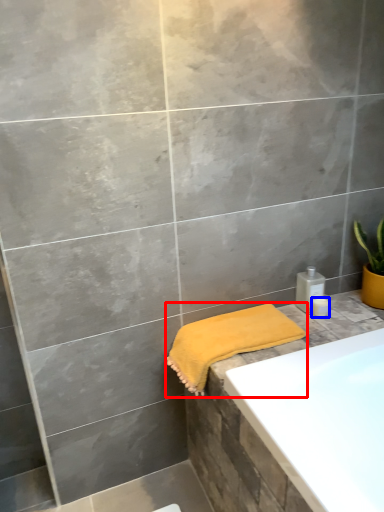
Question: Which point is closer to the camera, towel (highlighted by a red box) or toiletry (highlighted by a blue box)?

Choices:
 (A) towel
 (B) toiletry

Answer: (A)